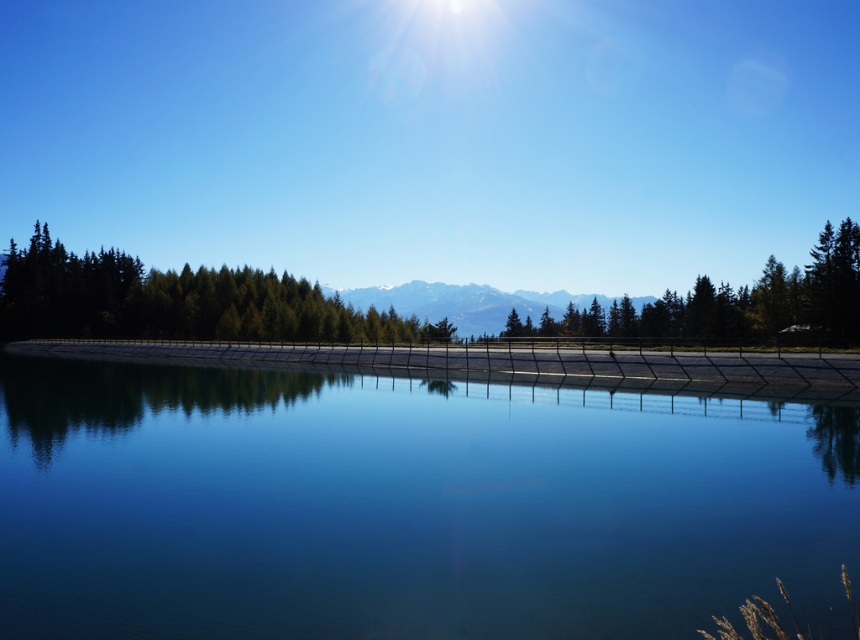
You are an architect designing a new observation deck that needs to have a clear view of both the green matte trees at center and the snowy white mountain at center. Based on their heights, which object will appear taller from the deck?

The snowy white mountain at center appears taller than the green matte trees at center because the green matte trees at center has a lesser height compared to snowy white mountain at center.